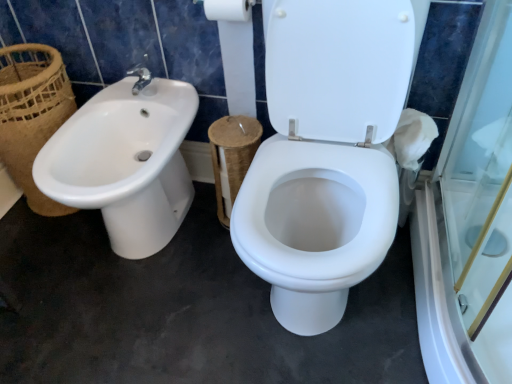
Image resolution: width=512 pixels, height=384 pixels. Find the location of `vacant space to the left of white glossy sink at left`. vacant space to the left of white glossy sink at left is located at coordinates (42, 251).